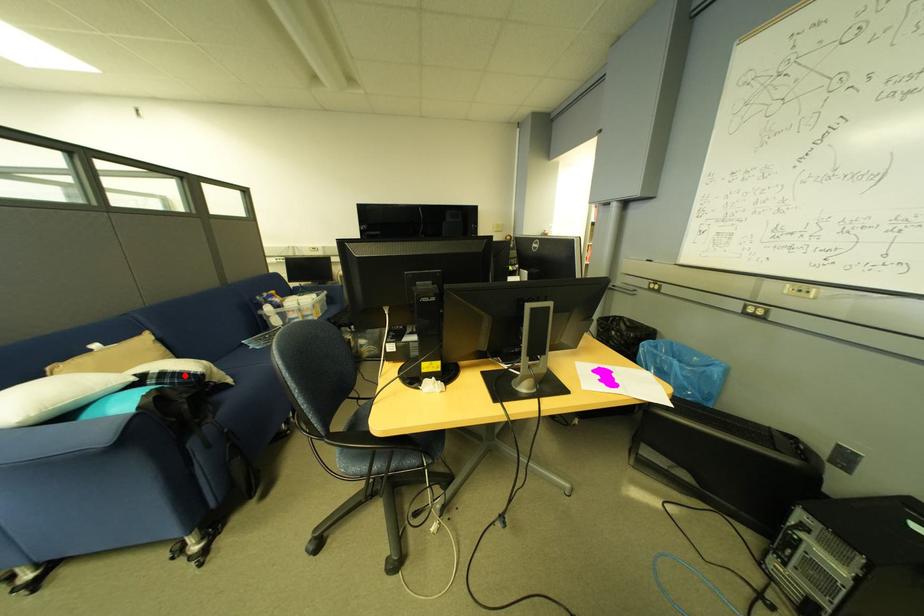
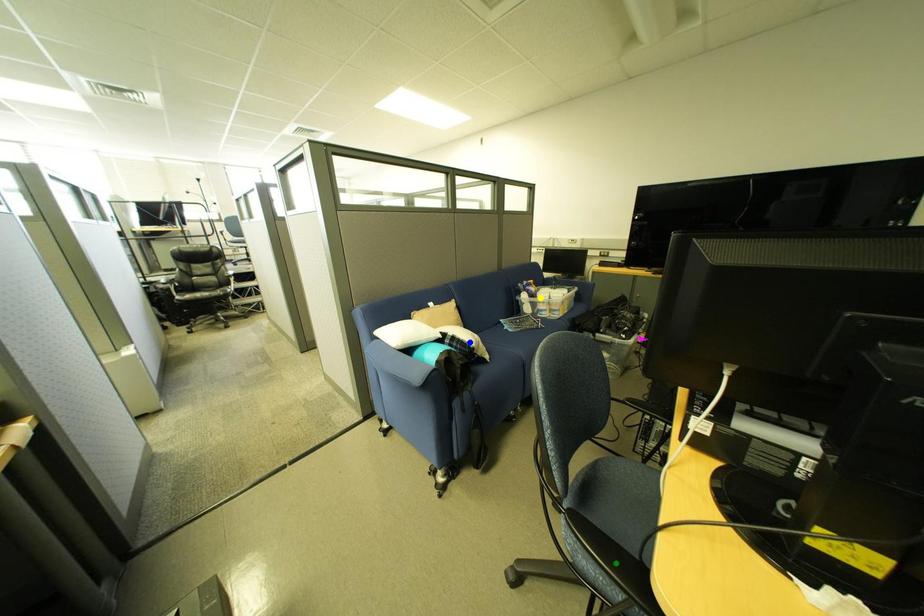
Question: I am providing you with two images of the same scene from different viewpoints. A red point is marked on the first image. You are given multiple points on the second image. Which mark in image 2 goes with the point in image 1?

Choices:
 (A) yellow point
 (B) green point
 (C) blue point

Answer: (C)